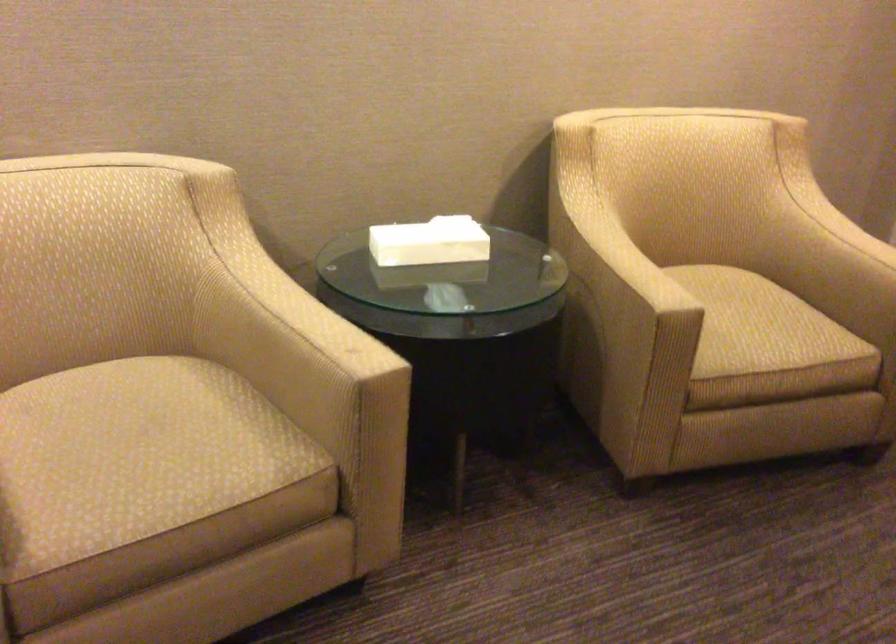
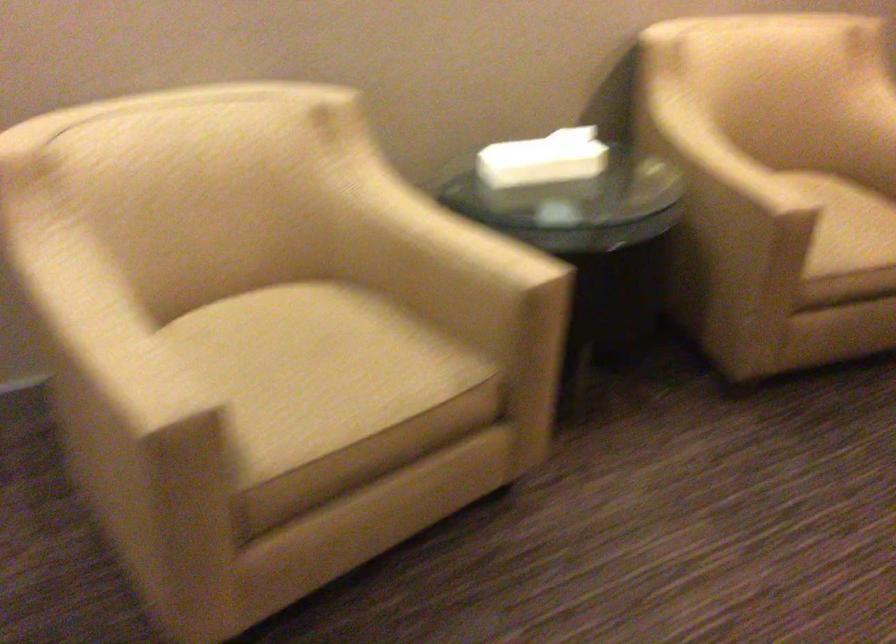
The point at (746, 326) is marked in the first image. Where is the corresponding point in the second image?

(846, 225)